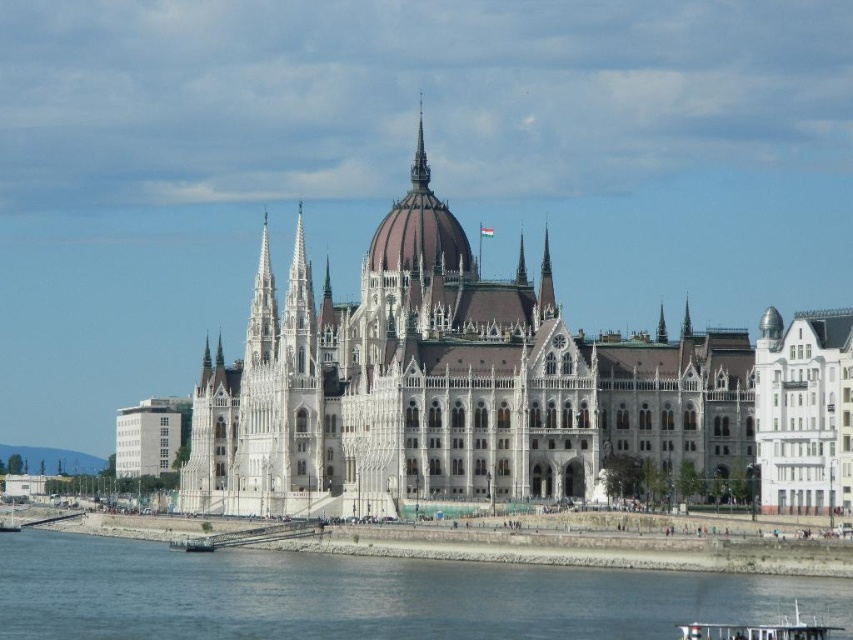
You are standing on the observation deck of the Hungarian Parliament Building and looking out. You see the gray concrete river at lower center and the smooth silver spire at upper center. Which object is closer to you?

The gray concrete river at lower center is closer to you because it is in front of the smooth silver spire at upper center.